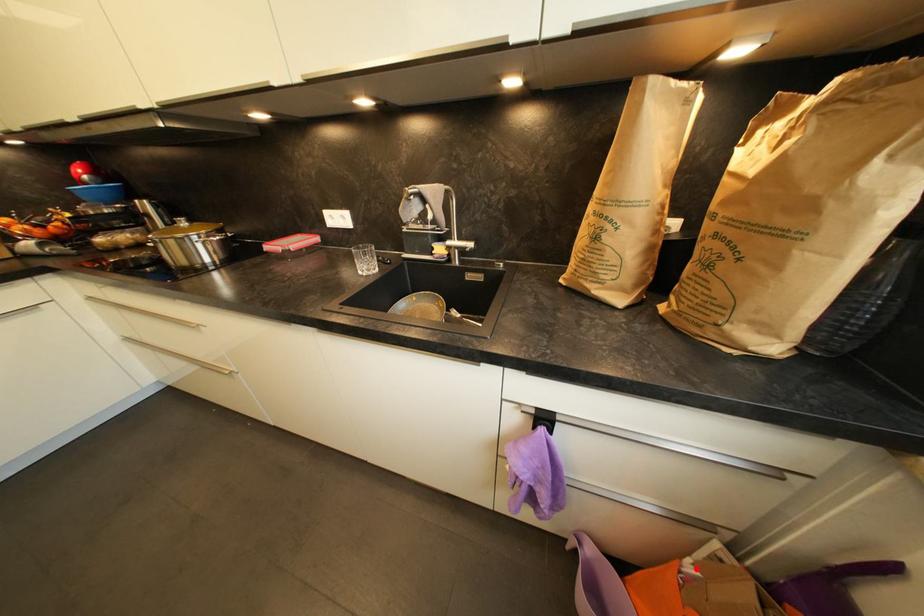
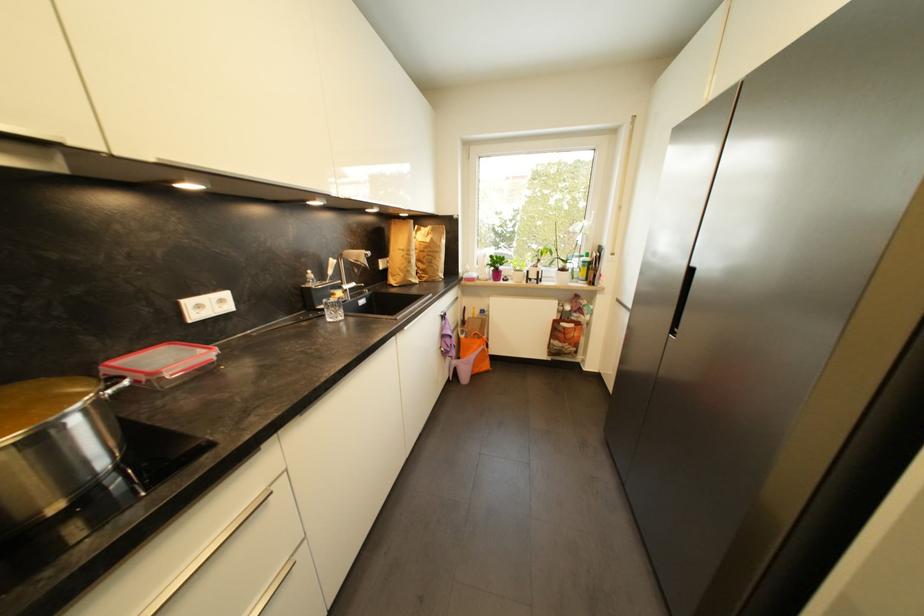
Question: I am providing you with two images of the same scene from different viewpoints. A red point is shown in image1. For the corresponding object point in image2, is it positioned nearer or farther from the camera?

Choices:
 (A) Nearer
 (B) Farther

Answer: (A)